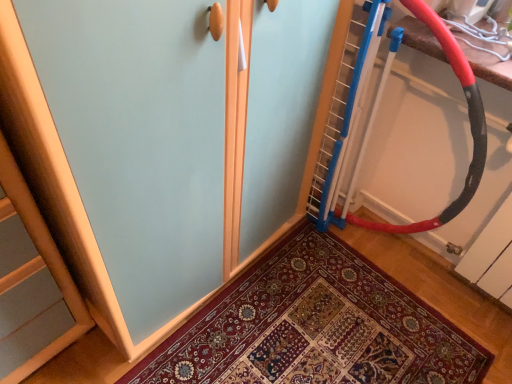
You are a GUI agent. You are given a task and a screenshot of the screen. Output one action in this format:
    pyautogui.click(x=<x>, y=<y>)
    Task: Click on the vacant space underneath patterned carpet at center (from a real-world perspective)
    
    Given the screenshot: What is the action you would take?
    pyautogui.click(x=311, y=333)